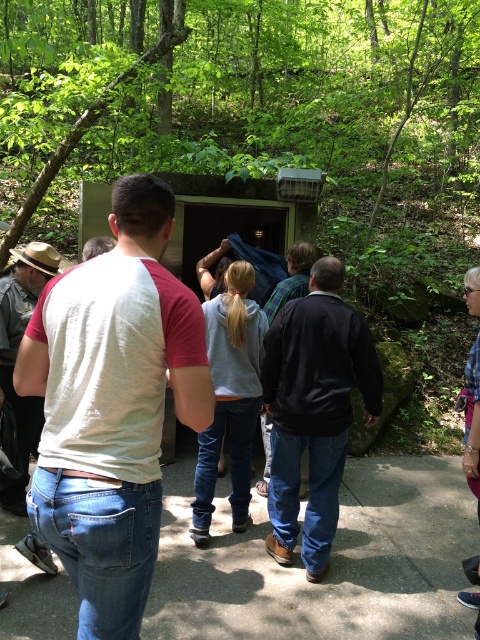
Is green leafy forest at center further to the viewer compared to matte brown hat at left?

Yes, green leafy forest at center is further from the viewer.

Does point (432, 225) lie in front of point (37, 422)?

No, (432, 225) is further to viewer.

Who is more forward, (421, 189) or (25, 280)?

Point (25, 280) is in front.

Locate an element on the screen. green leafy forest at center is located at coordinates (264, 120).

Does black leather jacket at center have a lesser width compared to matte brown hat at left?

In fact, black leather jacket at center might be wider than matte brown hat at left.

The image size is (480, 640). Find the location of `black leather jacket at center`. black leather jacket at center is located at coordinates (313, 410).

Is point (316, 301) less distant than point (13, 268)?

Yes, point (316, 301) is in front of point (13, 268).

The width and height of the screenshot is (480, 640). Find the location of `black leather jacket at center`. black leather jacket at center is located at coordinates (313, 410).

Which is above, green leafy forest at center or black leather jacket at center?

green leafy forest at center is higher up.

Which is behind, point (255, 147) or point (337, 284)?

Point (255, 147)

Does point (351, 81) lie in front of point (265, 538)?

No, it is behind (265, 538).

Where is `green leafy forest at center`? green leafy forest at center is located at coordinates (264, 120).